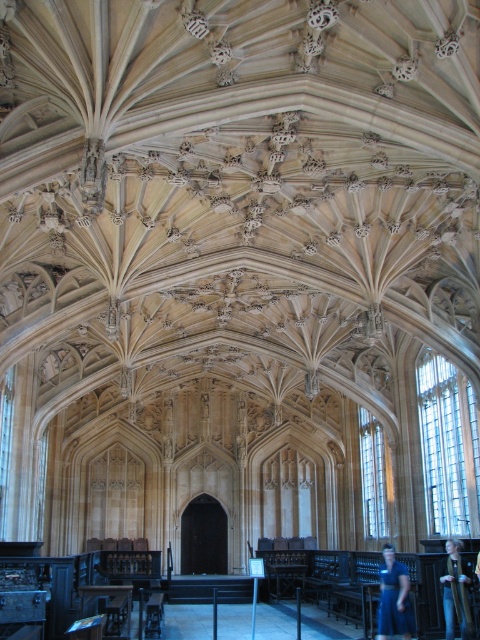
From the picture: Measure the distance between blue fabric at center and dark blue fabric at center.

blue fabric at center is 18.13 feet away from dark blue fabric at center.

Can you confirm if blue fabric at center is positioned above dark blue fabric at center?

No.

Measure the distance between blue fabric at center and camera.

69.05 meters

The width and height of the screenshot is (480, 640). In order to click on blue fabric at center in this screenshot , I will do `click(394, 596)`.